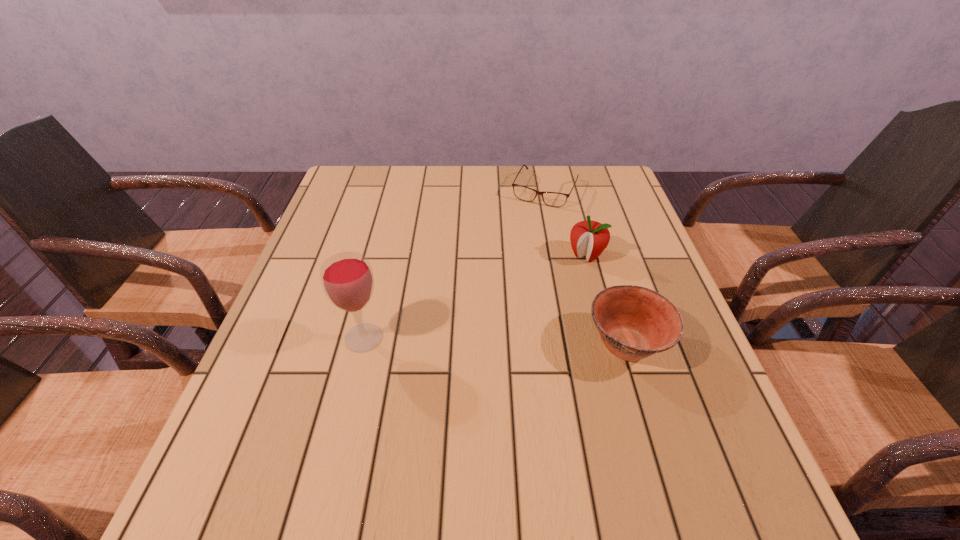
Image resolution: width=960 pixels, height=540 pixels. I want to click on free space in the image that satisfies the following two spatial constraints: 1. on the front side of the second tallest object; 2. on the right side of the bowl, so click(611, 345).